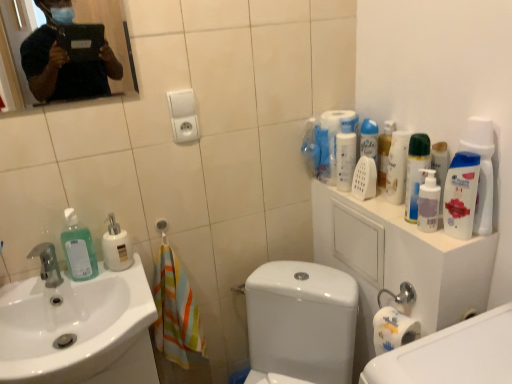
What is the approximate height of white glossy bottle at upper right, which is counted as the 3th cleaning product, starting from the right?

19.41 centimeters.

Where is `green matte spray can at upper right, which is counted as the second cleaning product, starting from the right`? This screenshot has height=384, width=512. green matte spray can at upper right, which is counted as the second cleaning product, starting from the right is located at coordinates (415, 172).

Identify the location of white glossy mouthwash at upper right, which ranks as the second mouthwash in back-to-front order. (461, 195).

How much space does green matte soap dispenser at left, the first cleaning product in the left-to-right sequence, occupy vertically?

21.24 centimeters.

At what (x,y) coordinates should I click in order to perform the action: click on translucent plastic mouthwash at upper right, placed as the 2th mouthwash when sorted from right to left. Please return your answer as a coordinate pair (x, y). Image resolution: width=512 pixels, height=384 pixels. Looking at the image, I should click on (384, 151).

You are a GUI agent. You are given a task and a screenshot of the screen. Output one action in this format:
    pyautogui.click(x=<x>, y=<y>)
    Task: Click on the matte black tablet at upper left
    
    Given the screenshot: What is the action you would take?
    pyautogui.click(x=109, y=33)

Locate an element on the screen. Image resolution: width=512 pixels, height=384 pixels. white glossy bottle at upper right, which is counted as the 3th cleaning product, starting from the left is located at coordinates (346, 153).

Between white glossy mouthwash at upper right, which ranks as the second mouthwash in back-to-front order, and white matte pump bottle at right, placed as the first cleaning product when sorted from right to left, which one has more height?

white glossy mouthwash at upper right, which ranks as the second mouthwash in back-to-front order, is taller.

From a real-world perspective, is white glossy mouthwash at upper right, which is counted as the 2th mouthwash, starting from the left, positioned over white matte pump bottle at right, the 6th cleaning product positioned from the left, based on gravity?

Yes, from a real-world perspective, white glossy mouthwash at upper right, which is counted as the 2th mouthwash, starting from the left, is on top of white matte pump bottle at right, the 6th cleaning product positioned from the left.

Is white glossy mouthwash at upper right, which is the first mouthwash from right to left, not within white matte pump bottle at right, placed as the first cleaning product when sorted from right to left?

Yes.

What's the angular difference between white glossy mouthwash at upper right, which is counted as the first mouthwash, starting from the front, and white matte pump bottle at right, placed as the first cleaning product when sorted from right to left,'s facing directions?

17.1 degrees.

Is white glossy soap dispenser at left, which is the fifth cleaning product from right to left, completely or partially outside of white matte pump bottle at right, the 6th cleaning product positioned from the left?

Absolutely, white glossy soap dispenser at left, which is the fifth cleaning product from right to left, is external to white matte pump bottle at right, the 6th cleaning product positioned from the left.

Could you tell me if white glossy soap dispenser at left, which is the fifth cleaning product from right to left, is turned towards white matte pump bottle at right, the 6th cleaning product positioned from the left?

No.

How distant is white glossy soap dispenser at left, which is the fifth cleaning product from right to left, from white matte pump bottle at right, placed as the first cleaning product when sorted from right to left?

A distance of 33.85 inches exists between white glossy soap dispenser at left, which is the fifth cleaning product from right to left, and white matte pump bottle at right, placed as the first cleaning product when sorted from right to left.

In the scene shown: In terms of height, does white glossy soap dispenser at left, which is the fifth cleaning product from right to left, look taller or shorter compared to white matte pump bottle at right, placed as the first cleaning product when sorted from right to left?

white glossy soap dispenser at left, which is the fifth cleaning product from right to left, is taller than white matte pump bottle at right, placed as the first cleaning product when sorted from right to left.

Considering the positions of objects white matte pump bottle at right, placed as the first cleaning product when sorted from right to left, and matte black tablet at upper left in the image provided, who is more to the right, white matte pump bottle at right, placed as the first cleaning product when sorted from right to left, or matte black tablet at upper left?

Positioned to the right is white matte pump bottle at right, placed as the first cleaning product when sorted from right to left.

In the scene shown: How different are the orientations of white matte pump bottle at right, the 6th cleaning product positioned from the left, and matte black tablet at upper left in degrees?

The angle between the facing direction of white matte pump bottle at right, the 6th cleaning product positioned from the left, and the facing direction of matte black tablet at upper left is 89.6 degrees.

Identify the location of mirror in front of the white matte pump bottle at right, the 6th cleaning product positioned from the left. The image size is (512, 384). (109, 33).

Between white glossy bottle at upper right, the 4th cleaning product positioned from the right, and white glossy mouthwash at upper right, which is the first mouthwash from right to left, which one has less height?

Standing shorter between the two is white glossy mouthwash at upper right, which is the first mouthwash from right to left.

From a real-world perspective, which object rests below the other?

white glossy mouthwash at upper right, which is the first mouthwash from right to left.

Can you tell me how much white glossy bottle at upper right, which is counted as the 3th cleaning product, starting from the left, and white glossy mouthwash at upper right, which is counted as the first mouthwash, starting from the front, differ in facing direction?

24.9 degrees separate the facing orientations of white glossy bottle at upper right, which is counted as the 3th cleaning product, starting from the left, and white glossy mouthwash at upper right, which is counted as the first mouthwash, starting from the front.

In the scene shown: Could you tell me if white glossy bottle at upper right, the 4th cleaning product positioned from the right, is facing white glossy mouthwash at upper right, which ranks as the second mouthwash in back-to-front order?

No, white glossy bottle at upper right, the 4th cleaning product positioned from the right, is not facing towards white glossy mouthwash at upper right, which ranks as the second mouthwash in back-to-front order.

From a real-world perspective, who is located higher, white matte pump bottle at right, the 6th cleaning product positioned from the left, or green matte soap dispenser at left, acting as the 6th cleaning product starting from the right?

white matte pump bottle at right, the 6th cleaning product positioned from the left, from a real-world perspective.

Is white matte pump bottle at right, the 6th cleaning product positioned from the left, positioned far away from green matte soap dispenser at left, acting as the 6th cleaning product starting from the right?

white matte pump bottle at right, the 6th cleaning product positioned from the left, is near green matte soap dispenser at left, acting as the 6th cleaning product starting from the right, not far away.

Is white matte pump bottle at right, the 6th cleaning product positioned from the left, taller than green matte soap dispenser at left, the first cleaning product in the left-to-right sequence?

No, white matte pump bottle at right, the 6th cleaning product positioned from the left, is not taller than green matte soap dispenser at left, the first cleaning product in the left-to-right sequence.

Considering the positions of objects white matte pump bottle at right, placed as the first cleaning product when sorted from right to left, and green matte soap dispenser at left, acting as the 6th cleaning product starting from the right, in the image provided, who is in front, white matte pump bottle at right, placed as the first cleaning product when sorted from right to left, or green matte soap dispenser at left, acting as the 6th cleaning product starting from the right,?

white matte pump bottle at right, placed as the first cleaning product when sorted from right to left, is in front.

Is white glossy mouthwash at upper right, which is counted as the first mouthwash, starting from the front, looking in the opposite direction of white glossy bottle at upper right, which is counted as the 4th cleaning product, starting from the left?

That's not correct — white glossy mouthwash at upper right, which is counted as the first mouthwash, starting from the front, is not looking away from white glossy bottle at upper right, which is counted as the 4th cleaning product, starting from the left.

Is white glossy mouthwash at upper right, which is counted as the 2th mouthwash, starting from the left, with white glossy bottle at upper right, which is counted as the 3th cleaning product, starting from the right?

Result: There is a gap between white glossy mouthwash at upper right, which is counted as the 2th mouthwash, starting from the left, and white glossy bottle at upper right, which is counted as the 3th cleaning product, starting from the right.

Is point (465, 210) positioned after point (404, 186)?

No, (465, 210) is closer to viewer.

Consider the image. Between white glossy mouthwash at upper right, which is the first mouthwash from right to left, and white glossy bottle at upper right, which is counted as the 3th cleaning product, starting from the right, which one appears on the right side from the viewer's perspective?

From the viewer's perspective, white glossy mouthwash at upper right, which is the first mouthwash from right to left, appears more on the right side.

Considering the positions of points (467, 197) and (409, 142), is point (467, 197) farther from camera compared to point (409, 142)?

No.

Are white glossy mouthwash at upper right, which is the first mouthwash from right to left, and green matte spray can at upper right, which is counted as the second cleaning product, starting from the right, beside each other?

Yes, white glossy mouthwash at upper right, which is the first mouthwash from right to left, is right next to green matte spray can at upper right, which is counted as the second cleaning product, starting from the right, and making contact.

Who is shorter, white glossy mouthwash at upper right, which is counted as the 2th mouthwash, starting from the left, or green matte spray can at upper right, which is counted as the second cleaning product, starting from the right?

white glossy mouthwash at upper right, which is counted as the 2th mouthwash, starting from the left, is shorter.

Considering the relative sizes of white glossy mouthwash at upper right, which is the first mouthwash from right to left, and green matte spray can at upper right, which is counted as the second cleaning product, starting from the right, in the image provided, is white glossy mouthwash at upper right, which is the first mouthwash from right to left, wider than green matte spray can at upper right, which is counted as the second cleaning product, starting from the right,?

No.

At what (x,y) coordinates should I click in order to perform the action: click on mouthwash on the right of white matte pump bottle at right, the 6th cleaning product positioned from the left. Please return your answer as a coordinate pair (x, y). The image size is (512, 384). Looking at the image, I should click on (461, 195).

Where is `the 4th cleaning product in front when counting from the white glossy soap dispenser at left, which is the fifth cleaning product from right to left`? the 4th cleaning product in front when counting from the white glossy soap dispenser at left, which is the fifth cleaning product from right to left is located at coordinates (x=428, y=202).

When comparing their distances from white glossy sink at lower left, does translucent plastic mouthwash at upper right, the first mouthwash viewed from the left, or green matte spray can at upper right, which is the fifth cleaning product in left-to-right order, seem closer?

green matte spray can at upper right, which is the fifth cleaning product in left-to-right order.

Looking at this image, from the image, which object appears to be farther from white glossy soap dispenser at left, arranged as the second cleaning product when viewed from the left, white glossy sink at lower left or white glossy mouthwash at upper right, which is counted as the 2th mouthwash, starting from the left?

white glossy mouthwash at upper right, which is counted as the 2th mouthwash, starting from the left, lies further to white glossy soap dispenser at left, arranged as the second cleaning product when viewed from the left, than the other object.

Estimate the real-world distances between objects in this image. Which object is further from white glossy mouthwash at upper right, which is the first mouthwash from right to left, matte black tablet at upper left or white glossy sink at lower left?

matte black tablet at upper left is positioned further to the anchor white glossy mouthwash at upper right, which is the first mouthwash from right to left.

When comparing their distances from green matte spray can at upper right, which is the fifth cleaning product in left-to-right order, does white glossy mouthwash at upper right, which ranks as the second mouthwash in back-to-front order, or white glossy bottle at upper right, which is counted as the 3th cleaning product, starting from the right, seem closer?

white glossy bottle at upper right, which is counted as the 3th cleaning product, starting from the right, is closer to green matte spray can at upper right, which is the fifth cleaning product in left-to-right order.

Looking at this image, looking at the image, which one is located further to matte black tablet at upper left, white glossy sink at lower left or white matte pump bottle at right, placed as the first cleaning product when sorted from right to left?

Based on the image, white matte pump bottle at right, placed as the first cleaning product when sorted from right to left, appears to be further to matte black tablet at upper left.

From the picture: When comparing their distances from white glossy mouthwash at upper right, which is the first mouthwash from right to left, does green matte soap dispenser at left, the first cleaning product in the left-to-right sequence, or white glossy bottle at upper right, the 4th cleaning product positioned from the right, seem closer?

The object closer to white glossy mouthwash at upper right, which is the first mouthwash from right to left, is white glossy bottle at upper right, the 4th cleaning product positioned from the right.

Based on their spatial positions, is white glossy soap dispenser at left, which is the fifth cleaning product from right to left, or white glossy sink at lower left further from green matte spray can at upper right, which is counted as the second cleaning product, starting from the right?

white glossy sink at lower left is further to green matte spray can at upper right, which is counted as the second cleaning product, starting from the right.

From the image, which object appears to be nearer to white glossy bottle at upper right, which is counted as the 3th cleaning product, starting from the right, green matte spray can at upper right, which is the fifth cleaning product in left-to-right order, or green matte soap dispenser at left, the first cleaning product in the left-to-right sequence?

The object closer to white glossy bottle at upper right, which is counted as the 3th cleaning product, starting from the right, is green matte spray can at upper right, which is the fifth cleaning product in left-to-right order.

Locate an element on the screen. The width and height of the screenshot is (512, 384). mirror between green matte soap dispenser at left, the first cleaning product in the left-to-right sequence, and green matte spray can at upper right, which is counted as the second cleaning product, starting from the right, in the horizontal direction is located at coordinates (109, 33).

Find the location of `mouthwash situated between white glossy sink at lower left and white matte pump bottle at right, the 6th cleaning product positioned from the left, from left to right`. mouthwash situated between white glossy sink at lower left and white matte pump bottle at right, the 6th cleaning product positioned from the left, from left to right is located at coordinates (384, 151).

Where is `sink situated between matte black tablet at upper left and translucent plastic mouthwash at upper right, placed as the 2th mouthwash when sorted from right to left, from left to right`? Image resolution: width=512 pixels, height=384 pixels. sink situated between matte black tablet at upper left and translucent plastic mouthwash at upper right, placed as the 2th mouthwash when sorted from right to left, from left to right is located at coordinates (79, 330).

Locate an element on the screen. mirror between green matte soap dispenser at left, the first cleaning product in the left-to-right sequence, and white glossy bottle at upper right, which is counted as the 3th cleaning product, starting from the right, from left to right is located at coordinates (109, 33).